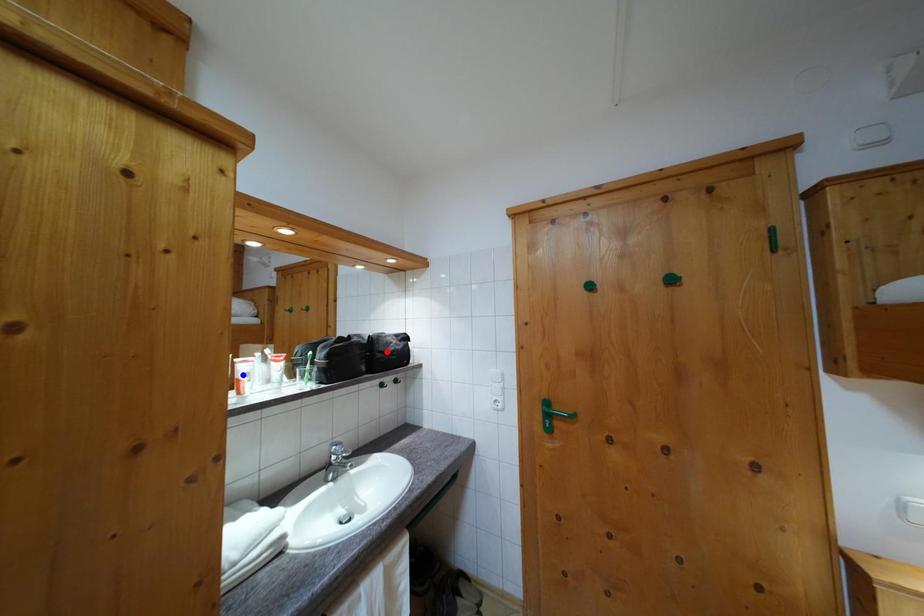
Question: Two points are marked on the image. Which point is closer to the camera?

Choices:
 (A) Blue point is closer.
 (B) Red point is closer.

Answer: (A)